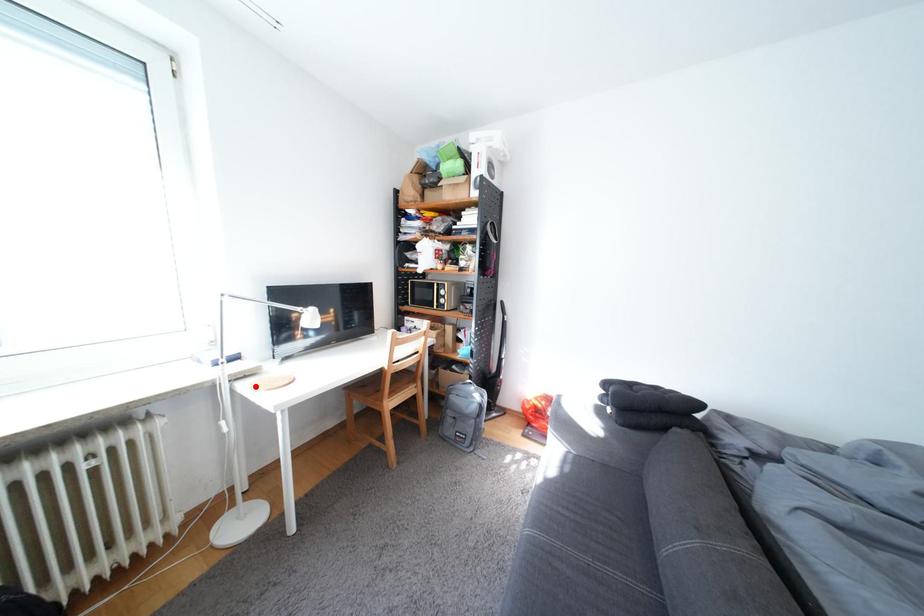
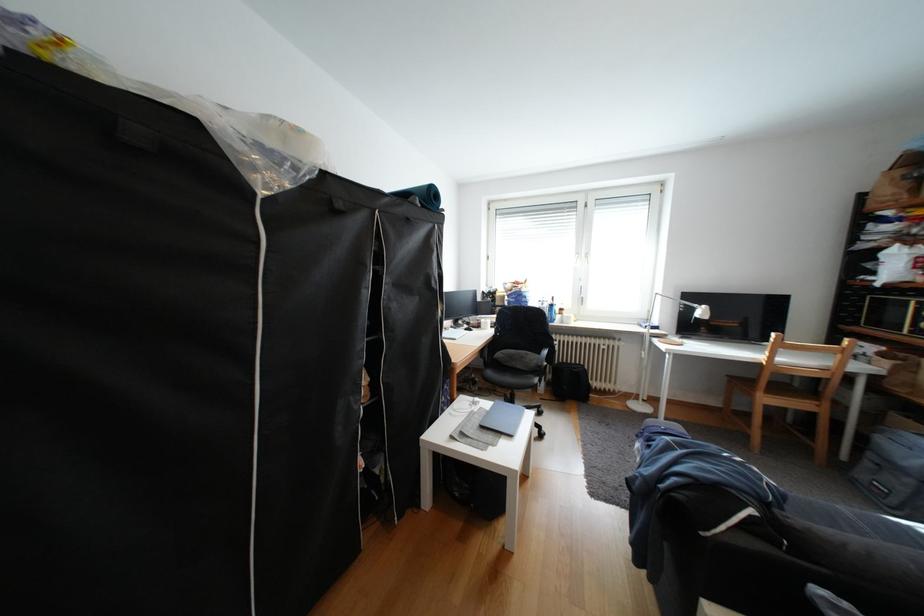
In the second image, find the point that corresponds to the highlighted location in the first image.

(667, 341)